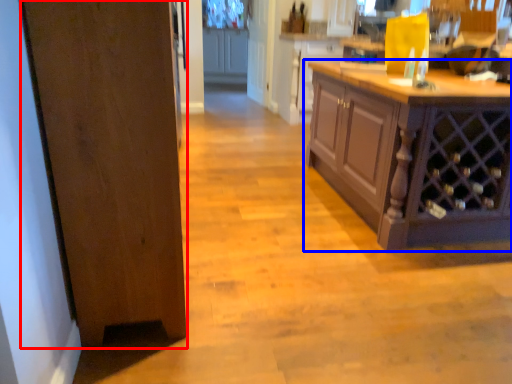
Question: Which of the following is the farthest to the observer, door (highlighted by a red box) or cabinetry (highlighted by a blue box)?

Choices:
 (A) door
 (B) cabinetry

Answer: (B)